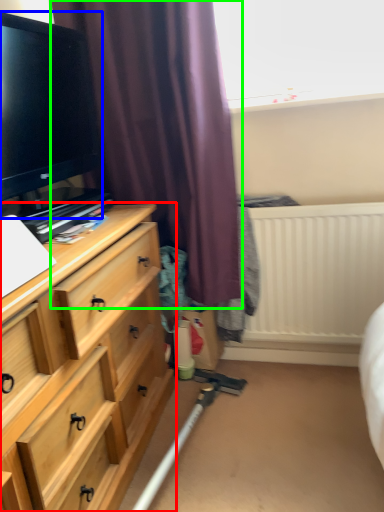
Question: Which object is positioned farthest from chest of drawers (highlighted by a red box)? Select from television (highlighted by a blue box) and curtain (highlighted by a green box).

Choices:
 (A) television
 (B) curtain

Answer: (A)